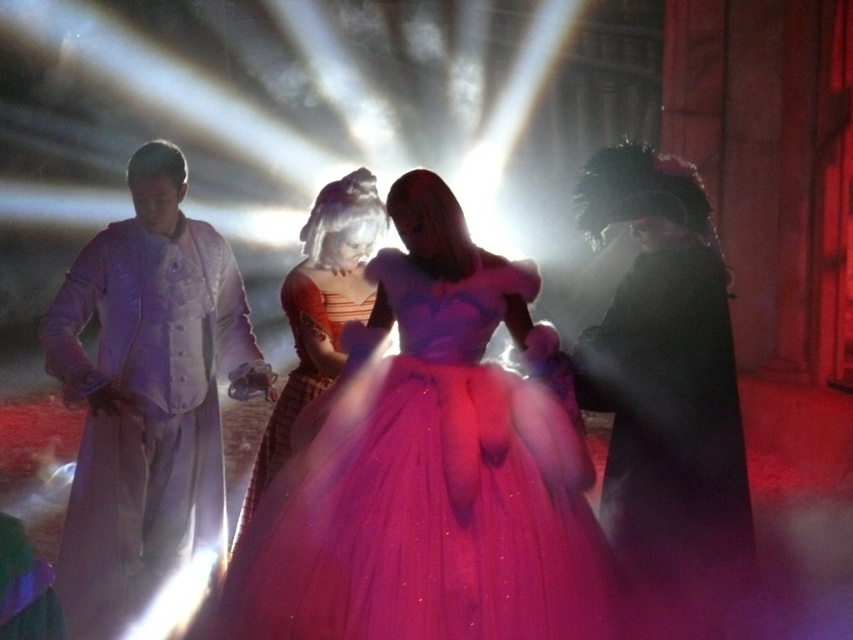
Question: Can you confirm if sparkly tulle dress at center is positioned to the right of shiny purple gown at center?

Choices:
 (A) no
 (B) yes

Answer: (A)

Question: Which object appears closest to the camera in this image?

Choices:
 (A) matte white coat at left
 (B) matte orange dress at center
 (C) sparkly tulle dress at center

Answer: (C)

Question: Does sparkly tulle dress at center appear over matte white coat at left?

Choices:
 (A) yes
 (B) no

Answer: (B)

Question: Which of these objects is positioned farthest from the matte orange dress at center?

Choices:
 (A) matte white coat at left
 (B) shiny purple gown at center

Answer: (B)

Question: Which of the following is the farthest from the observer?

Choices:
 (A) [x=310, y=376]
 (B) [x=589, y=353]
 (C) [x=439, y=400]
 (D) [x=86, y=589]

Answer: (A)

Question: Can you confirm if sparkly tulle dress at center is smaller than matte orange dress at center?

Choices:
 (A) no
 (B) yes

Answer: (A)